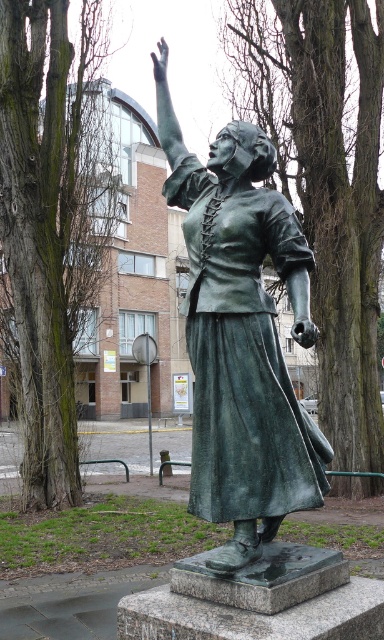
Question: Which of the following is the farthest from the observer?

Choices:
 (A) green textured tree at center
 (B) green mossy bark tree at left
 (C) green patina statue at center

Answer: (B)

Question: Can you confirm if green patina statue at center is positioned above green textured tree at center?

Choices:
 (A) yes
 (B) no

Answer: (B)

Question: Which object is the closest to the green patina statue at center?

Choices:
 (A) green mossy bark tree at left
 (B) green textured tree at center

Answer: (B)

Question: Can you confirm if green patina statue at center is positioned to the right of green mossy bark tree at left?

Choices:
 (A) yes
 (B) no

Answer: (A)

Question: In this image, where is green patina statue at center located relative to green mossy bark tree at left?

Choices:
 (A) above
 (B) below

Answer: (B)

Question: Which point is closer to the camera?

Choices:
 (A) green patina statue at center
 (B) green mossy bark tree at left

Answer: (A)